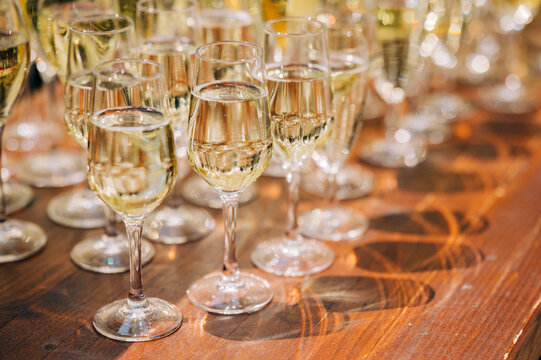
You are a GUI agent. You are given a task and a screenshot of the screen. Output one action in this format:
    pyautogui.click(x=<x>, y=<y>)
    Task: Click on the wine glass stems
    This screenshot has width=541, height=360.
    Given the screenshot: What is the action you would take?
    pyautogui.click(x=137, y=265), pyautogui.click(x=105, y=226), pyautogui.click(x=3, y=202), pyautogui.click(x=51, y=102), pyautogui.click(x=24, y=106), pyautogui.click(x=175, y=195), pyautogui.click(x=229, y=226), pyautogui.click(x=292, y=218), pyautogui.click(x=327, y=203), pyautogui.click(x=391, y=126)